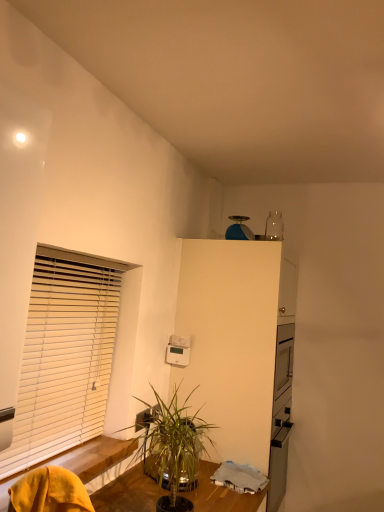
Question: Would you say white matte dresser at center is to the left or to the right of green leafy plant at lower center in the picture?

Choices:
 (A) right
 (B) left

Answer: (A)

Question: In terms of size, does white matte dresser at center appear bigger or smaller than green leafy plant at lower center?

Choices:
 (A) small
 (B) big

Answer: (B)

Question: Which object is positioned closest to the yellow fabric swivel chair at lower left?

Choices:
 (A) green leafy plant at lower center
 (B) white wooden blinds at left
 (C) white plastic thermostat at center, the second appliance positioned from the top
 (D) blue matte ball at upper center, arranged as the 1th appliance when viewed from the top
 (E) white matte dresser at center

Answer: (A)

Question: Which of these objects is positioned farthest from the white matte dresser at center?

Choices:
 (A) white wooden blinds at left
 (B) yellow fabric swivel chair at lower left
 (C) blue matte ball at upper center, marked as the second appliance in a left-to-right arrangement
 (D) green leafy plant at lower center
 (E) white plastic thermostat at center, which ranks as the 1th appliance in left-to-right order

Answer: (B)